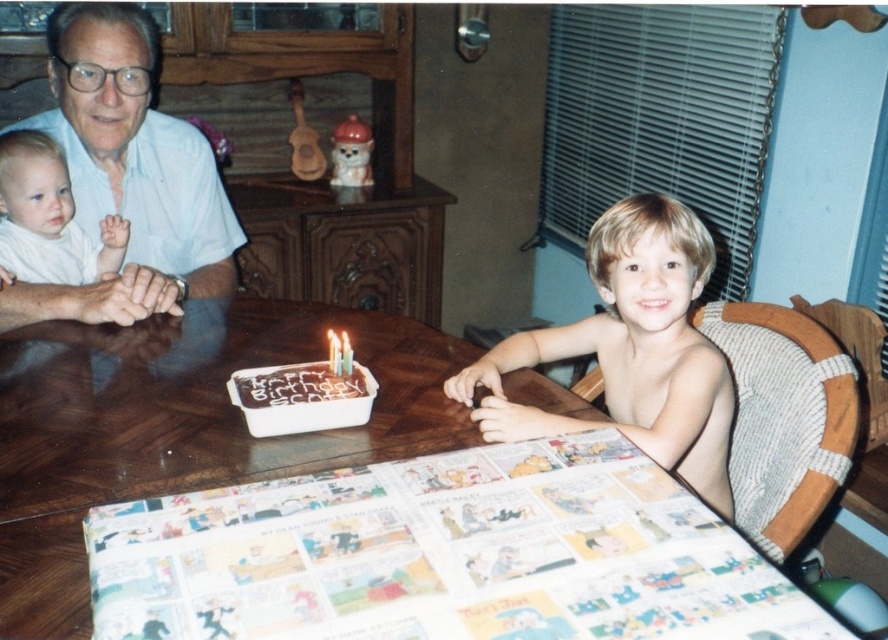
You are a photographer taking a picture of the birthday scene. The matte white shirt at upper left and the white wax candle at center are both in the frame. Which object is positioned higher in the image?

The matte white shirt at upper left is positioned higher than the white wax candle at center in the image.

You are a photographer setting up for a birthday photo. You need to ensure the brown wooden table at center and the matte white shirt at upper left are both visible in the frame. Given their sizes, which object should you focus on to ensure both are in the shot without cropping?

The brown wooden table at center is larger in size than the matte white shirt at upper left. To ensure both are visible without cropping, focus on framing the larger object first, which is the brown wooden table at center, as it requires more space.

You are a photographer standing in the dining room and want to take a photo of the brown wooden table at center and the white soft baby at upper left. Since you want the baby to be in focus, should you adjust your camera to focus on a higher or lower plane?

The brown wooden table at center is taller than white soft baby at upper left. To focus on the white soft baby at upper left, you should adjust the camera to focus on a lower plane.